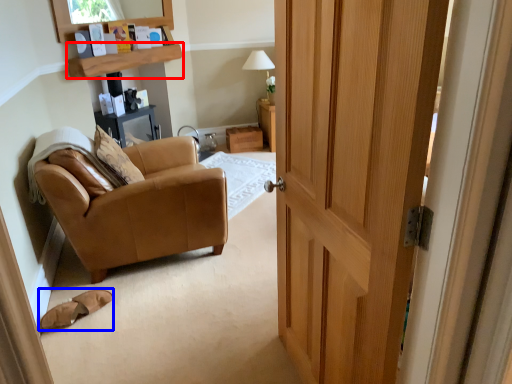
Question: Which point is closer to the camera, shelf (highlighted by a red box) or footwear (highlighted by a blue box)?

Choices:
 (A) shelf
 (B) footwear

Answer: (B)